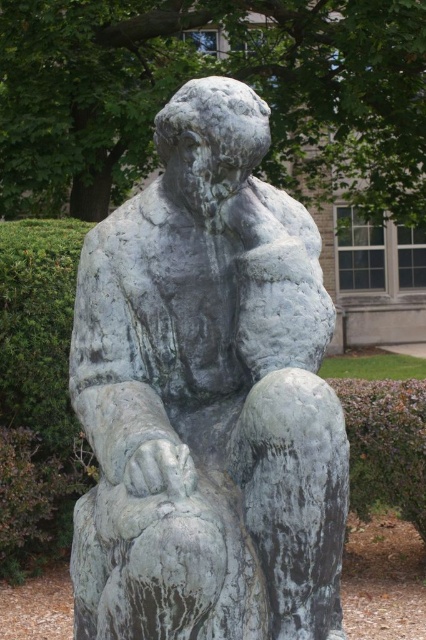
Is green patina stone statue at center bigger than green leafy hedge at lower right?

Yes, green patina stone statue at center is bigger than green leafy hedge at lower right.

How far apart are green patina stone statue at center and green leafy hedge at lower right?

green patina stone statue at center is 9.37 feet away from green leafy hedge at lower right.

Identify the location of green patina stone statue at center. (207, 397).

Locate an element on the screen. The image size is (426, 640). green patina stone statue at center is located at coordinates (207, 397).